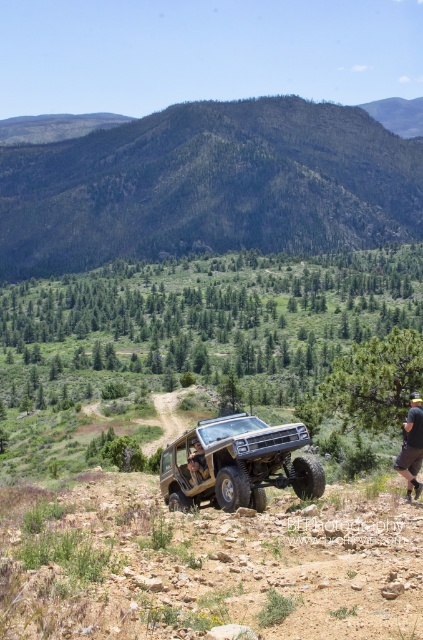
You are an offroad enthusiast planning to cross a narrow mountain path. You see the matte khaki jeep at center and the khaki shorts at lower right. Which vehicle has a wider body to ensure safe passage through the path?

The matte khaki jeep at center has a larger width than the khaki shorts at lower right, so it is wider and may have difficulty navigating narrow paths.